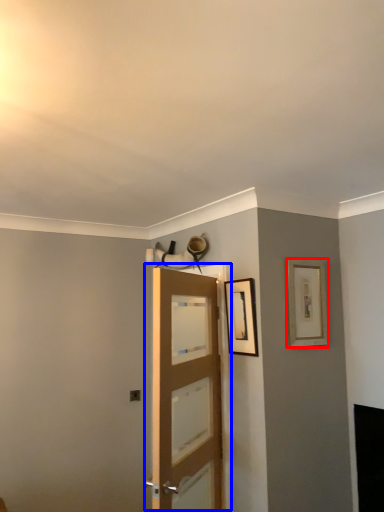
Question: Which object appears closest to the camera in this image, picture frame (highlighted by a red box) or door (highlighted by a blue box)?

Choices:
 (A) picture frame
 (B) door

Answer: (B)